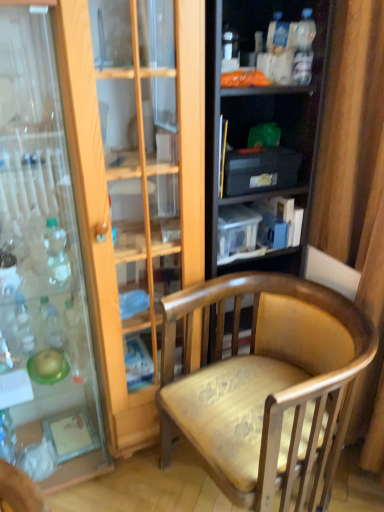
Question: From a real-world perspective, does wooden armchair at center stand above black plastic storage at upper center, which ranks as the first shelf in bottom-to-top order?

Choices:
 (A) no
 (B) yes

Answer: (A)

Question: Is wooden armchair at center bigger than black plastic storage at upper center, the 2th shelf from the top?

Choices:
 (A) yes
 (B) no

Answer: (A)

Question: From a real-world perspective, is wooden armchair at center below black plastic storage at upper center, the 2th shelf from the top?

Choices:
 (A) no
 (B) yes

Answer: (B)

Question: Does wooden armchair at center have a greater width compared to black plastic storage at upper center, the 2th shelf from the top?

Choices:
 (A) no
 (B) yes

Answer: (B)

Question: Considering the relative sizes of wooden armchair at center and black plastic storage at upper center, the 2th shelf from the top, in the image provided, is wooden armchair at center thinner than black plastic storage at upper center, the 2th shelf from the top,?

Choices:
 (A) yes
 (B) no

Answer: (B)

Question: From the image's perspective, does wooden armchair at center appear lower than black plastic storage at upper center, the 2th shelf from the top?

Choices:
 (A) yes
 (B) no

Answer: (A)

Question: From a real-world perspective, is black plastic storage at upper center, the 2th shelf from the top, beneath translucent plastic bottle at left, which appears as the 1th bottle when viewed from the back?

Choices:
 (A) yes
 (B) no

Answer: (B)

Question: Is the position of black plastic storage at upper center, which ranks as the first shelf in bottom-to-top order, more distant than that of translucent plastic bottle at left, which appears as the first bottle when ordered from the bottom?

Choices:
 (A) yes
 (B) no

Answer: (B)

Question: Is the position of black plastic storage at upper center, the 2th shelf from the top, less distant than that of translucent plastic bottle at left, which appears as the first bottle when ordered from the bottom?

Choices:
 (A) yes
 (B) no

Answer: (A)

Question: Are black plastic storage at upper center, the 2th shelf from the top, and translucent plastic bottle at left, which appears as the first bottle when ordered from the bottom, located far from each other?

Choices:
 (A) no
 (B) yes

Answer: (B)

Question: From a real-world perspective, is black plastic storage at upper center, the 2th shelf from the top, positioned over translucent plastic bottle at left, the 2th bottle positioned from the top, based on gravity?

Choices:
 (A) no
 (B) yes

Answer: (B)

Question: Does black plastic storage at upper center, which ranks as the first shelf in bottom-to-top order, have a greater width compared to translucent plastic bottle at left, placed as the 2th bottle when sorted from right to left?

Choices:
 (A) yes
 (B) no

Answer: (A)

Question: Is translucent plastic bottle at left, which appears as the first bottle when ordered from the bottom, located within wooden armchair at center?

Choices:
 (A) yes
 (B) no

Answer: (B)